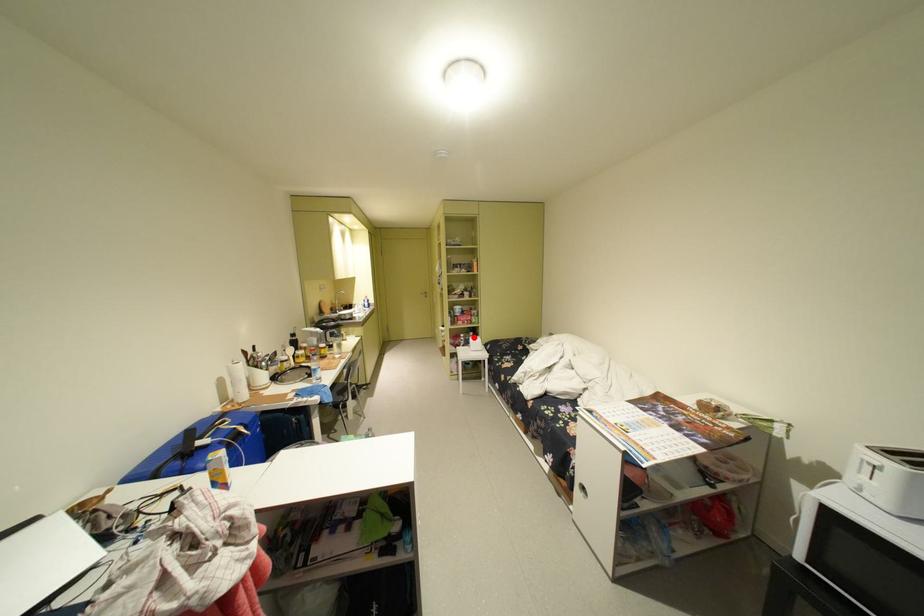
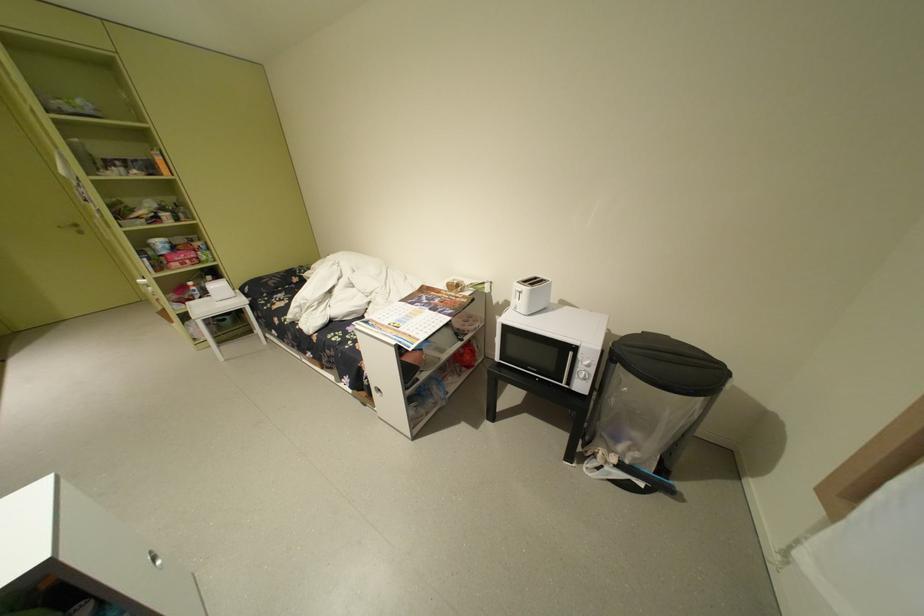
The point at the highlighted location is marked in the first image. Where is the corresponding point in the second image?

(204, 286)